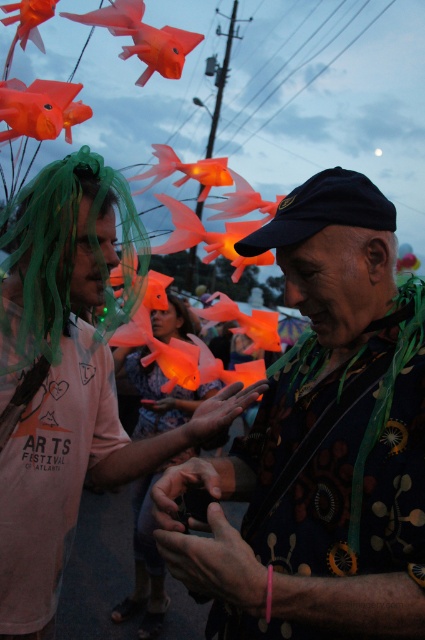
You are an event photographer at the ARTS FESTIVAL ATLANTA. You notice the matte orange fish at left and the green tulle wig at left in your frame. Which object is closer to the camera?

The matte orange fish at left is closer to the camera because it is in front of the green tulle wig at left.